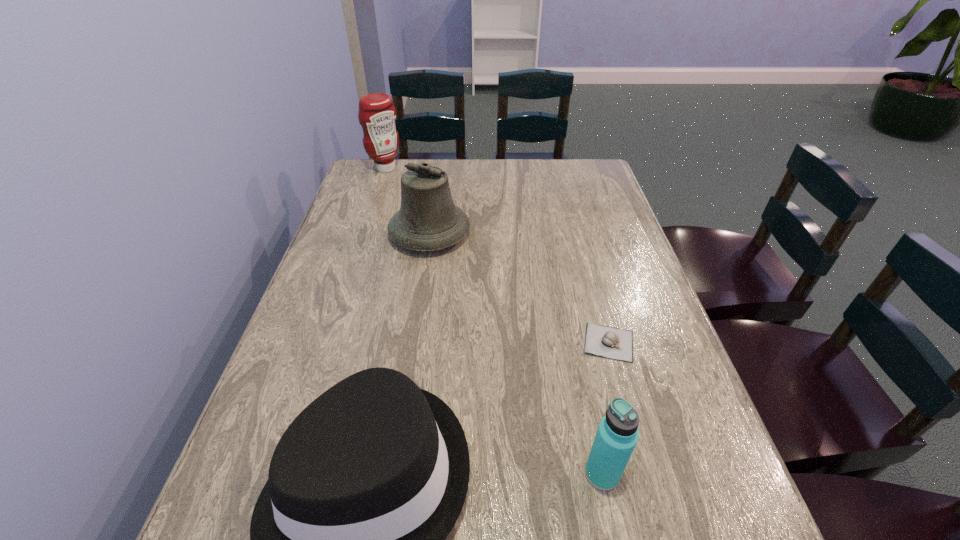
Locate an element on the screen. condiment that is at the left edge is located at coordinates (377, 114).

Locate an element on the screen. The width and height of the screenshot is (960, 540). bell at the left edge is located at coordinates 428,220.

Locate an element on the screen. The image size is (960, 540). object that is positioned at the right edge is located at coordinates click(x=603, y=341).

Locate an element on the screen. The height and width of the screenshot is (540, 960). object that is at the far left corner is located at coordinates (377, 114).

This screenshot has width=960, height=540. In the image, there is a desktop. Identify the location of vacant space at the far edge. (547, 167).

In the image, there is a desktop. Identify the location of free space at the left edge. The height and width of the screenshot is (540, 960). (360, 272).

The image size is (960, 540). In the image, there is a desktop. In order to click on vacant region at the right edge in this screenshot , I will do `click(663, 319)`.

Locate an element on the screen. The image size is (960, 540). free spot at the far left corner of the desktop is located at coordinates (375, 179).

I want to click on vacant space at the far right corner of the desktop, so click(565, 192).

Identify the location of vacant point located between the thermos bottle and the fourth nearest object. (516, 354).